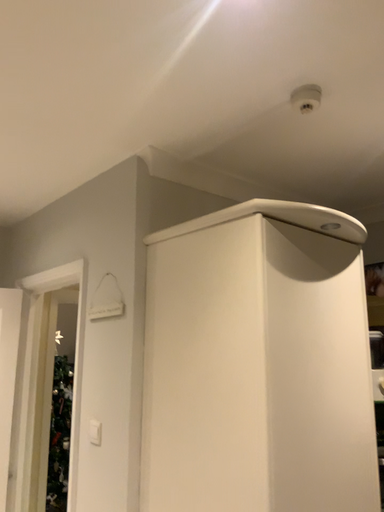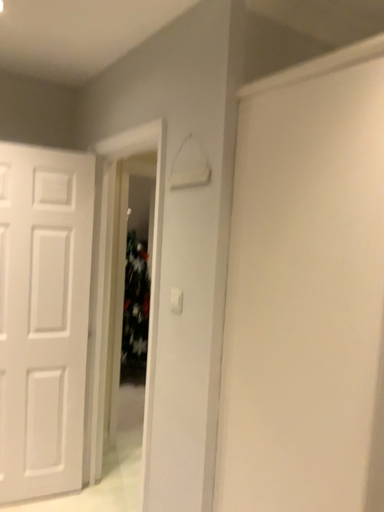
Question: Which way did the camera rotate in the video?

Choices:
 (A) rotated right
 (B) rotated left

Answer: (B)